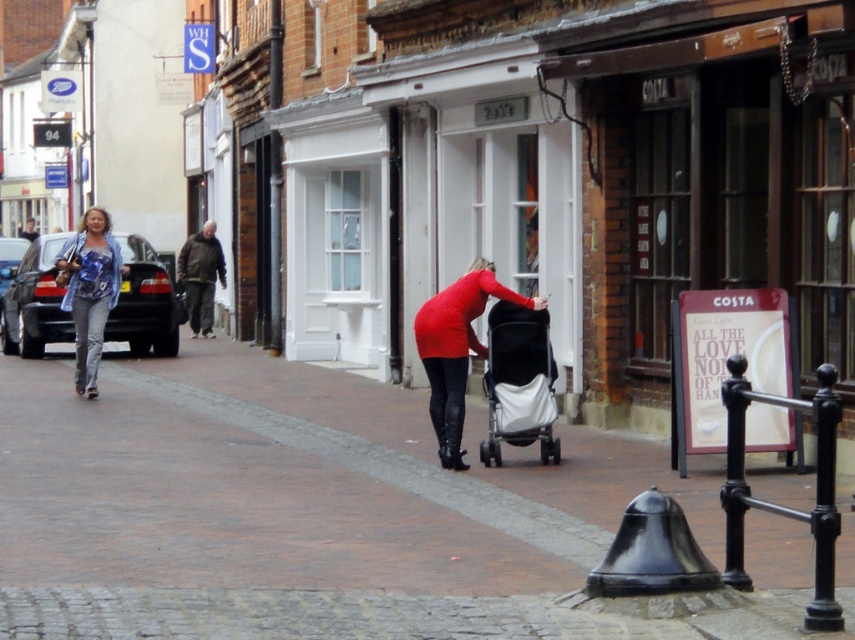
Based on the photo, which of these two, brown cobblestone pavement at center or brown leather jacket at center, stands shorter?

brown cobblestone pavement at center

Does point (534, 509) lie in front of point (210, 250)?

Yes, it is in front of point (210, 250).

The height and width of the screenshot is (640, 855). What are the coordinates of `brown cobblestone pavement at center` in the screenshot? It's located at (323, 513).

Is point (482, 266) behind point (189, 301)?

No, it is not.

Locate an element on the screen. matte red shirt at center is located at coordinates (457, 348).

The width and height of the screenshot is (855, 640). Describe the element at coordinates (519, 381) in the screenshot. I see `black matte baby carriage at center` at that location.

Who is positioned more to the right, black matte baby carriage at center or shiny black car at left?

From the viewer's perspective, black matte baby carriage at center appears more on the right side.

What do you see at coordinates (519, 381) in the screenshot? I see `black matte baby carriage at center` at bounding box center [519, 381].

Locate an element on the screen. black matte baby carriage at center is located at coordinates (519, 381).